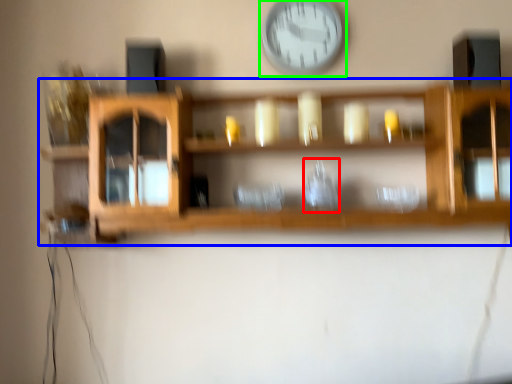
Question: Which object is the closest to the glass vase (highlighted by a red box)? Choose among these: shelf (highlighted by a blue box) or wall clock (highlighted by a green box).

Choices:
 (A) shelf
 (B) wall clock

Answer: (A)